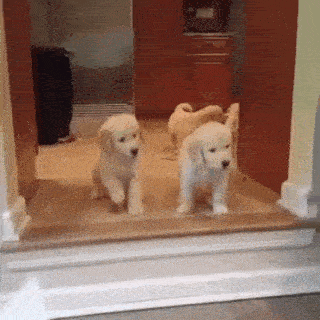
At what (x,y) coordinates should I click in order to perform the action: click on floor. Please return your answer as a coordinate pair (x, y). This screenshot has width=320, height=320. Looking at the image, I should click on click(x=57, y=174).